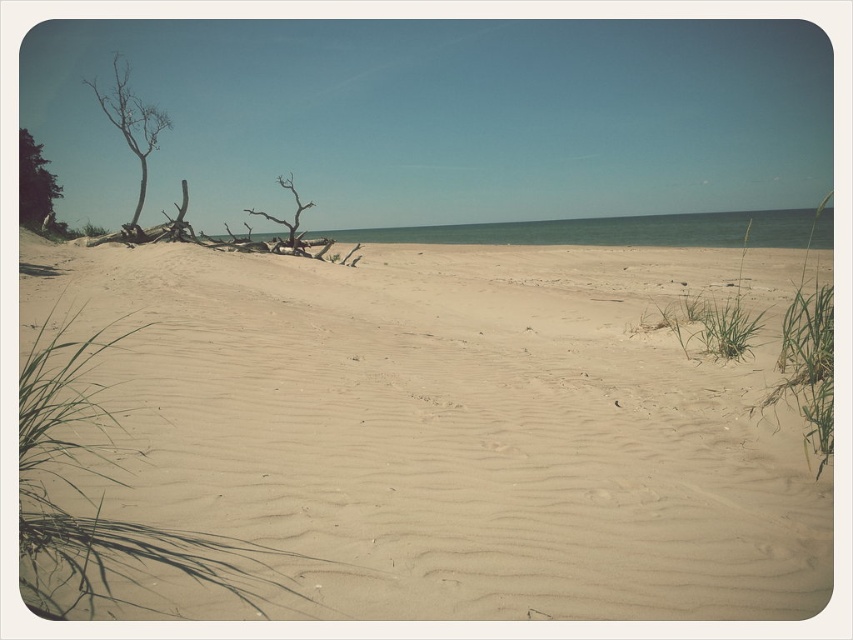
Question: Which object is closer to the camera taking this photo?

Choices:
 (A) bare wood tree at left
 (B) green leafy tree at left

Answer: (A)

Question: Which point appears closest to the camera in this image?

Choices:
 (A) (44, 186)
 (B) (254, 212)
 (C) (730, 552)

Answer: (C)

Question: Which object is farther from the camera taking this photo?

Choices:
 (A) green leafy tree at left
 (B) bare wood tree at left

Answer: (A)

Question: Is the position of bare wood tree at left less distant than that of brown driftwood at center?

Choices:
 (A) yes
 (B) no

Answer: (A)

Question: Is smooth sand at center positioned behind bare wood tree at left?

Choices:
 (A) yes
 (B) no

Answer: (B)

Question: Does bare wood tree at left have a lesser width compared to brown driftwood at center?

Choices:
 (A) no
 (B) yes

Answer: (A)